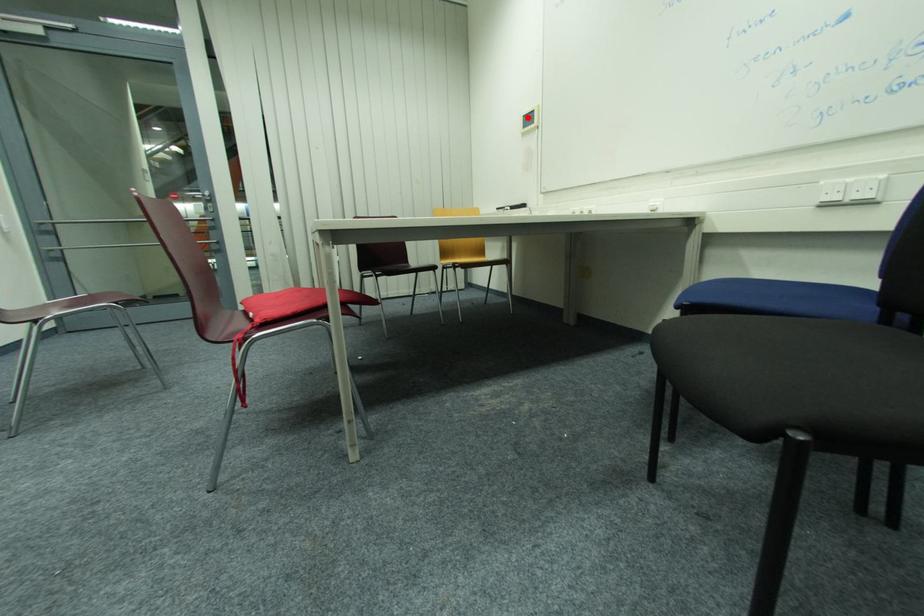
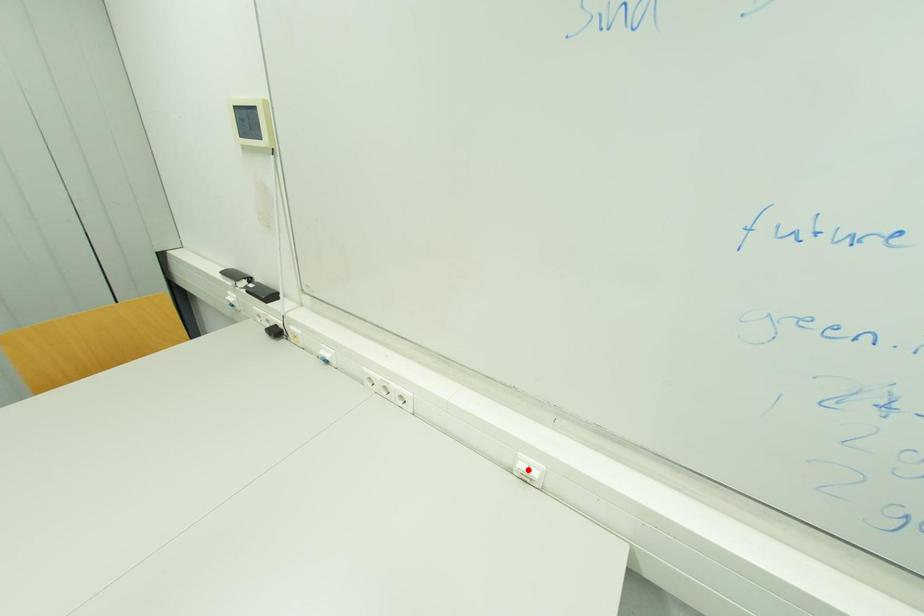
I am providing you with two images of the same scene from different viewpoints. A red point is marked on the first image and another point is marked on the second image. Are the points marked in image1 and image2 representing the same 3D position?

No